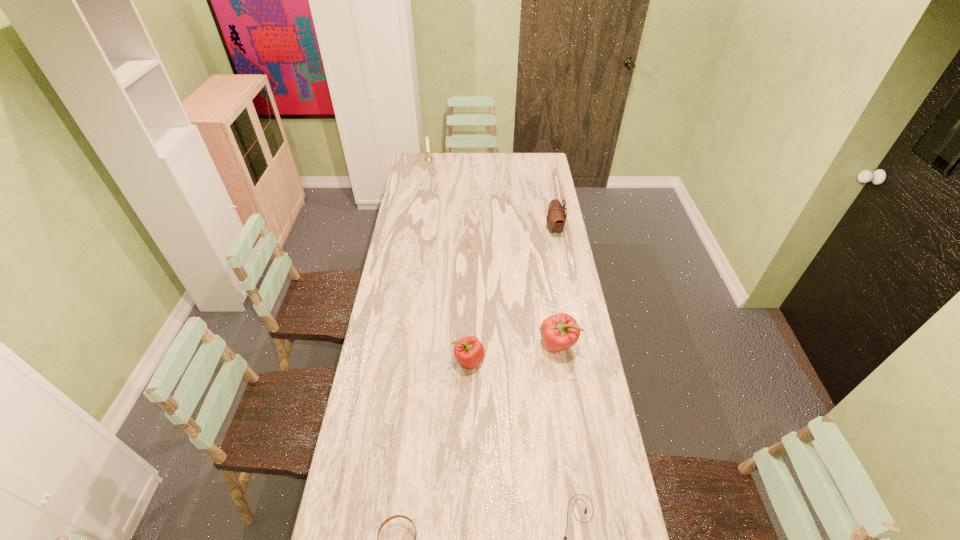
The image size is (960, 540). I want to click on vacant space located 0.200m on the back of the taller bell pepper, so click(x=550, y=293).

Find the location of a particular element. This screenshot has width=960, height=540. vacant space situated on the back of the shorter bell pepper is located at coordinates (470, 300).

Where is `object positioned at the far edge`? object positioned at the far edge is located at coordinates (428, 159).

Where is `object at the left edge`? This screenshot has width=960, height=540. object at the left edge is located at coordinates (428, 159).

Identify the location of pouch at the right edge. (556, 217).

Locate an element on the screen. bell pepper that is at the right edge is located at coordinates (559, 332).

Identify the location of object that is at the far left corner. The height and width of the screenshot is (540, 960). (428, 159).

Identify the location of vacant space at the far edge. The image size is (960, 540). (471, 168).

Identify the location of free location at the left edge of the desktop. (379, 450).

Find the location of a particular element. vacant space at the right edge of the desktop is located at coordinates (600, 477).